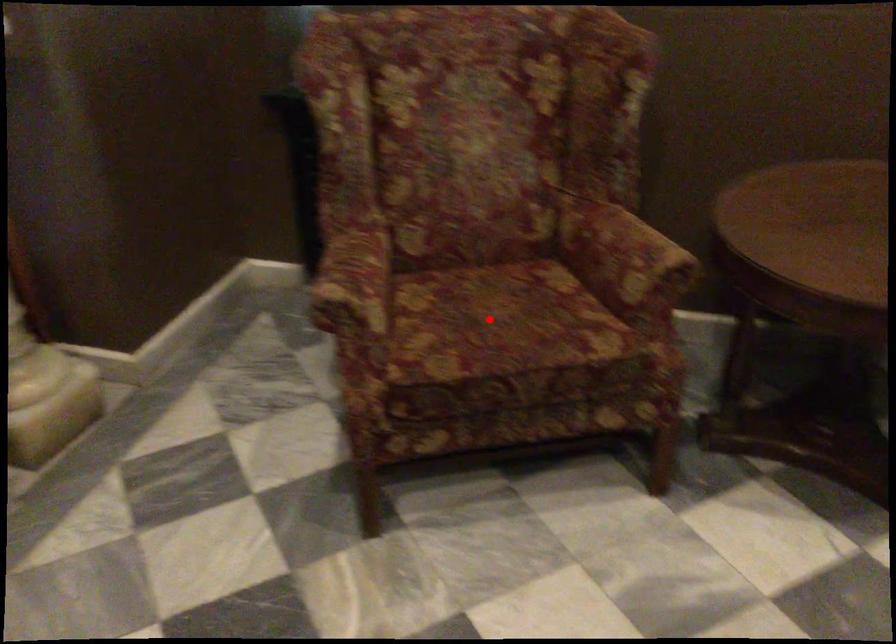
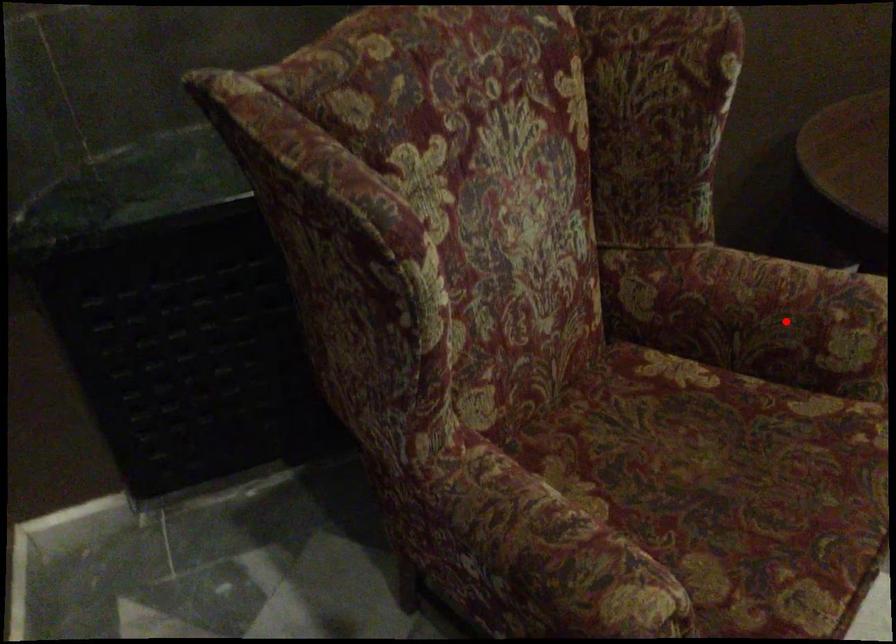
I am providing you with two images of the same scene from different viewpoints. A red point is marked on the first image and another point is marked on the second image. Does the point marked in image1 correspond to the same location as the one in image2?

No